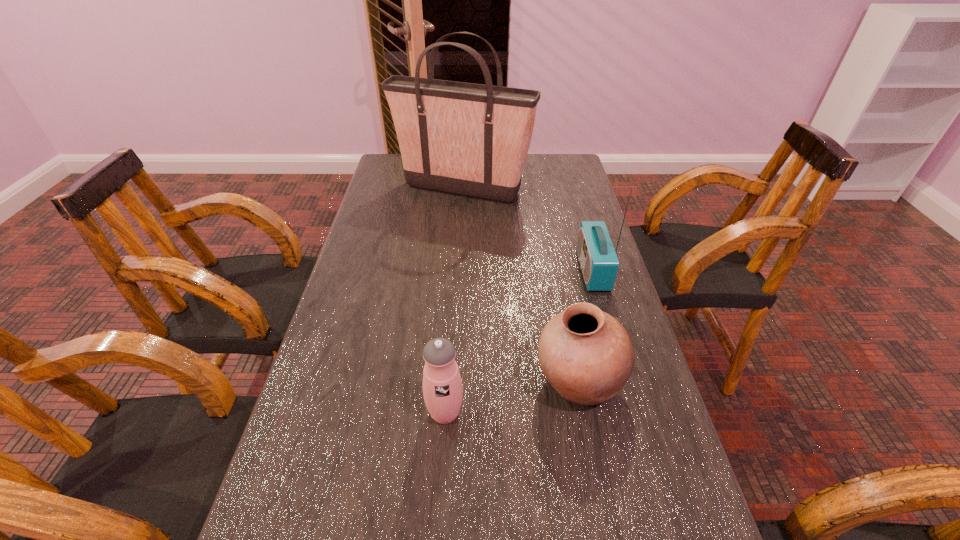
Locate an element on the screen. This screenshot has width=960, height=540. vacant position located on the right of the thermos bottle is located at coordinates (620, 413).

Where is `free space located on the front of the pottery`? This screenshot has height=540, width=960. free space located on the front of the pottery is located at coordinates (593, 455).

Where is `object at the far edge`? This screenshot has width=960, height=540. object at the far edge is located at coordinates (468, 139).

Locate an element on the screen. The height and width of the screenshot is (540, 960). object positioned at the left edge is located at coordinates click(x=468, y=139).

Identify the location of radio receiver that is at the right edge. This screenshot has height=540, width=960. coord(599,263).

Image resolution: width=960 pixels, height=540 pixels. In order to click on pottery situated at the right edge in this screenshot , I will do `click(586, 355)`.

This screenshot has height=540, width=960. What are the coordinates of `object that is at the far left corner` in the screenshot? It's located at (468, 139).

You are a GUI agent. You are given a task and a screenshot of the screen. Output one action in this format:
    pyautogui.click(x=<x>, y=<y>)
    Task: Click on the vacant space at the left edge
    This screenshot has width=960, height=540.
    Given the screenshot: What is the action you would take?
    point(348,281)

Locate an element on the screen. vacant space at the right edge of the desktop is located at coordinates (596, 295).

What are the coordinates of `free space between the shopping bag and the third shortest object` in the screenshot? It's located at click(x=527, y=230).